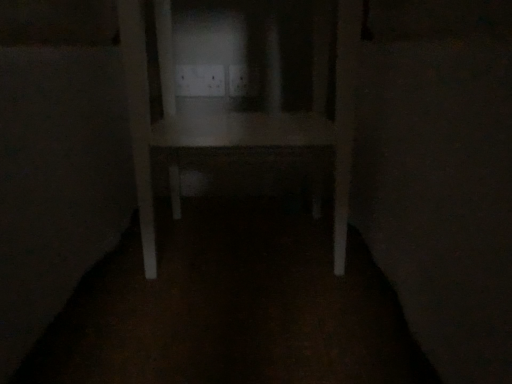
Question: Should I look upward or downward to see white plastic electric outlet at center, which is the 1th electric outlet in left-to-right order?

Choices:
 (A) down
 (B) up

Answer: (B)

Question: Which direction should I rotate to face white plastic electric outlet at center, which appears as the first electric outlet when viewed from the right, — up or down?

Choices:
 (A) down
 (B) up

Answer: (B)

Question: From the image's perspective, is white matte table at center below white plastic electric outlet at center, which appears as the first electric outlet when viewed from the right?

Choices:
 (A) no
 (B) yes

Answer: (B)

Question: From a real-world perspective, does white matte table at center stand above white plastic electric outlet at center, which appears as the first electric outlet when viewed from the right?

Choices:
 (A) yes
 (B) no

Answer: (B)

Question: Considering the relative sizes of white matte table at center and white plastic electric outlet at center, positioned as the second electric outlet in left-to-right order, in the image provided, is white matte table at center shorter than white plastic electric outlet at center, positioned as the second electric outlet in left-to-right order,?

Choices:
 (A) no
 (B) yes

Answer: (A)

Question: Can you confirm if white matte table at center is wider than white plastic electric outlet at center, which appears as the first electric outlet when viewed from the right?

Choices:
 (A) yes
 (B) no

Answer: (A)

Question: Is the depth of white matte table at center less than that of white plastic electric outlet at center, positioned as the second electric outlet in left-to-right order?

Choices:
 (A) no
 (B) yes

Answer: (B)

Question: Is white matte table at center taller than white plastic electric outlet at center, which appears as the first electric outlet when viewed from the right?

Choices:
 (A) yes
 (B) no

Answer: (A)

Question: Is white plastic electric outlet at center, which is the 1th electric outlet in left-to-right order, shorter than white matte table at center?

Choices:
 (A) yes
 (B) no

Answer: (A)

Question: Does white plastic electric outlet at center, which is the 1th electric outlet in left-to-right order, have a greater height compared to white matte table at center?

Choices:
 (A) yes
 (B) no

Answer: (B)

Question: Is there a large distance between white plastic electric outlet at center, which is the 1th electric outlet in left-to-right order, and white matte table at center?

Choices:
 (A) yes
 (B) no

Answer: (B)

Question: From a real-world perspective, is white plastic electric outlet at center, the 2th electric outlet in the right-to-left sequence, located higher than white matte table at center?

Choices:
 (A) yes
 (B) no

Answer: (A)

Question: Could you tell me if white plastic electric outlet at center, which is the 1th electric outlet in left-to-right order, is facing white matte table at center?

Choices:
 (A) no
 (B) yes

Answer: (B)

Question: From the image's perspective, is white plastic electric outlet at center, which is the 1th electric outlet in left-to-right order, below white matte table at center?

Choices:
 (A) no
 (B) yes

Answer: (A)

Question: Is white plastic electric outlet at center, which appears as the first electric outlet when viewed from the right, surrounding white plastic electric outlet at center, the 2th electric outlet in the right-to-left sequence?

Choices:
 (A) no
 (B) yes

Answer: (A)